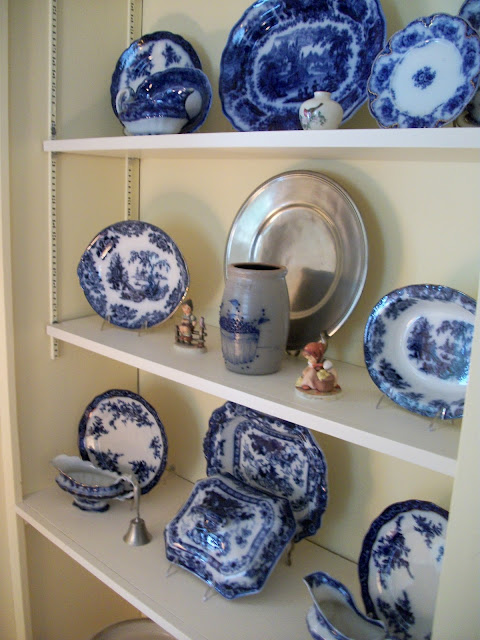
This screenshot has width=480, height=640. Find the location of `silver plate`. silver plate is located at coordinates (317, 234).